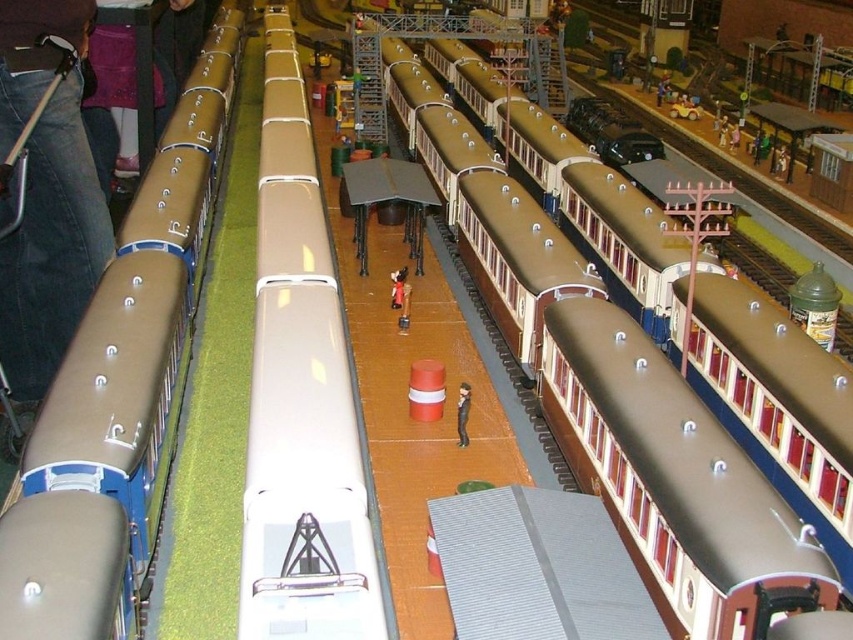
Who is more distant from viewer, (343,620) or (647,330)?

Positioned behind is point (647,330).

Who is more forward, (294, 243) or (660, 243)?

Point (294, 243) is in front.

Where is `white glossy train car at center`? The image size is (853, 640). white glossy train car at center is located at coordinates (302, 362).

Identify the location of white glossy train car at center. (302, 362).

I want to click on white glossy train car at center, so click(x=302, y=362).

Looking at this image, measure the distance between brown matte train at center and camera.

They are 7.64 meters apart.

Where is `brown matte train at center`? brown matte train at center is located at coordinates (677, 540).